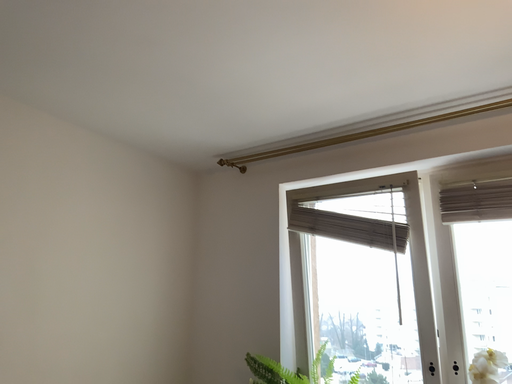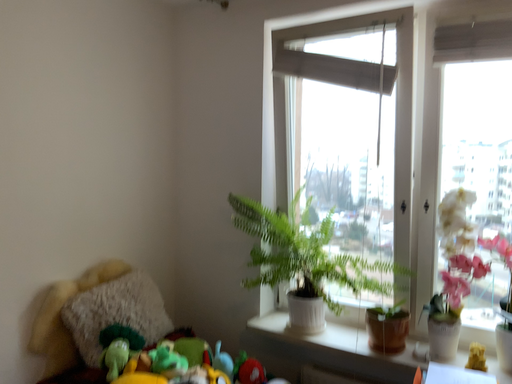
Question: Which way did the camera rotate in the video?

Choices:
 (A) rotated upward
 (B) rotated downward

Answer: (B)